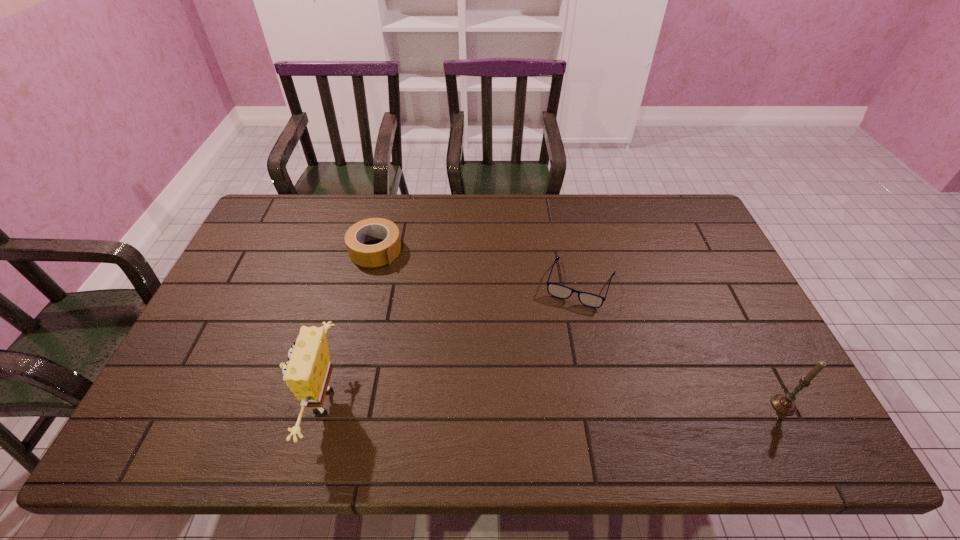
This screenshot has width=960, height=540. I want to click on free space between the rightmost object and the duct tape, so click(579, 327).

In order to click on blank region between the third object from left to right and the candle in this screenshot , I will do `click(682, 345)`.

Locate an element on the screen. The height and width of the screenshot is (540, 960). vacant space that's between the spectacles and the tallest object is located at coordinates (450, 343).

I want to click on vacant space that is in between the duct tape and the spectacles, so click(x=478, y=267).

This screenshot has height=540, width=960. In order to click on empty space that is in between the shortest object and the rightmost object in this screenshot , I will do `click(682, 345)`.

Locate an element on the screen. free space between the duct tape and the shortest object is located at coordinates (478, 267).

The height and width of the screenshot is (540, 960). I want to click on vacant point located between the sponge and the spectacles, so click(450, 343).

This screenshot has height=540, width=960. What are the coordinates of `the second closest object relative to the duct tape` in the screenshot? It's located at (559, 291).

Identify which object is located as the second nearest to the tallest object. Please provide its 2D coordinates. Your answer should be formatted as a tuple, i.e. [(x, y)], where the tuple contains the x and y coordinates of a point satisfying the conditions above.

[(559, 291)]

You are a GUI agent. You are given a task and a screenshot of the screen. Output one action in this format:
    pyautogui.click(x=<x>, y=<y>)
    Task: Click on the vacant region that satisfies the following two spatial constraints: 1. on the front side of the shortest object; 2. on the left side of the third shortest object
    The width and height of the screenshot is (960, 540).
    Given the screenshot: What is the action you would take?
    pyautogui.click(x=607, y=404)